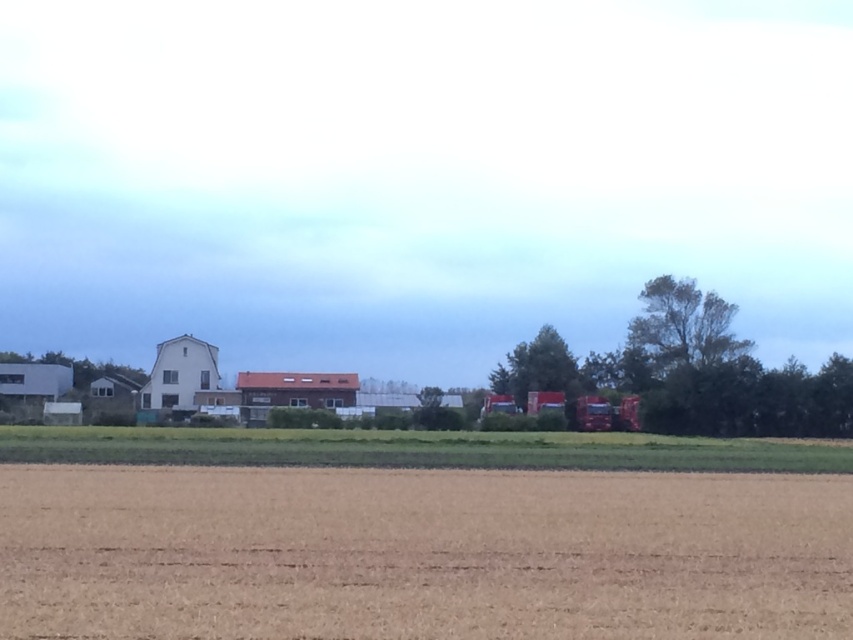
You are standing at the origin point of the image coordinate system. You want to walk to the brown matte wheat field at lower center. What are the coordinates you need to move to?

The coordinates you need to move to are point (421, 554).

You are standing at the point with coordinates point (x=172, y=376) and want to move towards the point with coordinates point (x=175, y=472). Are you moving towards the field or away from it?

You are moving towards the field because point (x=175, y=472) is in front of point (x=172, y=376), and the field is in the foreground.